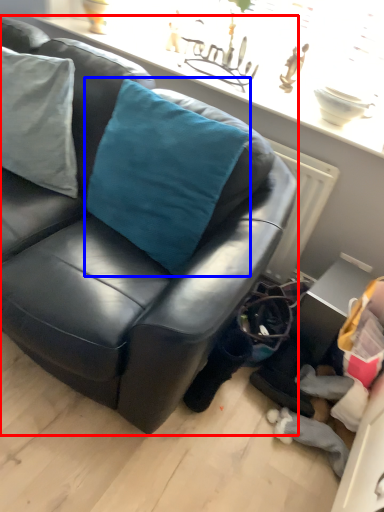
Question: Among these objects, which one is nearest to the camera, studio couch (highlighted by a red box) or throw pillow (highlighted by a blue box)?

Choices:
 (A) studio couch
 (B) throw pillow

Answer: (A)